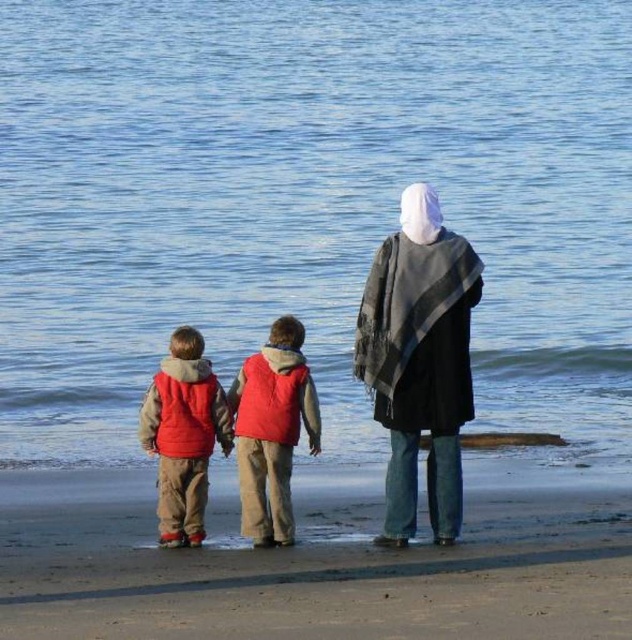
You are a photographer trying to capture the entire scene in one shot. Given that the brown sand at lower center is wider than the red fleece vest at center, which object would you need to adjust your camera angle to include more of?

Since the brown sand at lower center is wider than the red fleece vest at center, you would need to adjust your camera angle to include more of the brown sand at lower center to capture its full width in the shot.